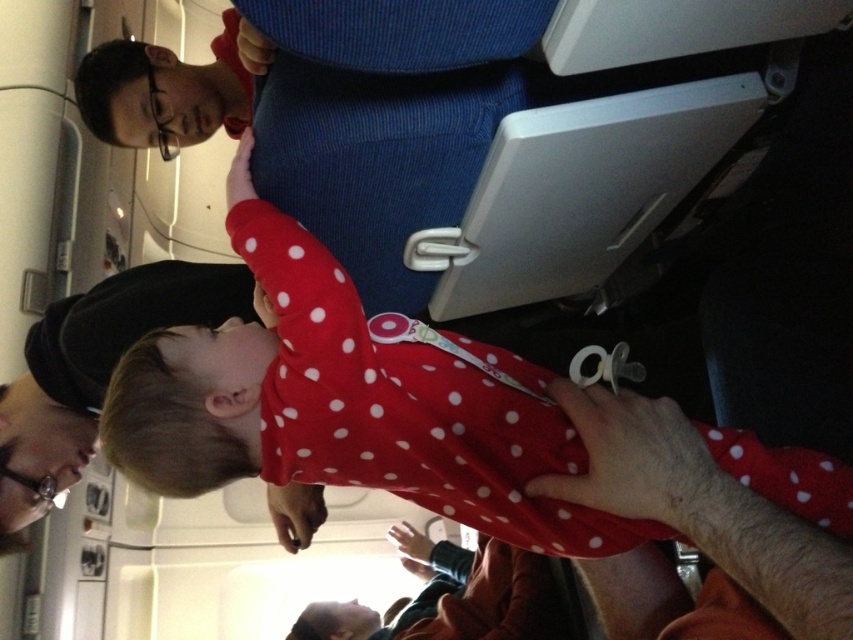
Between point (491, 515) and point (175, 77), which one is positioned in front?

Point (491, 515) is in front.

Can you confirm if red polka dot onesie at center is positioned below matte blue uniform at upper center?

Yes, red polka dot onesie at center is below matte blue uniform at upper center.

What do you see at coordinates (347, 403) in the screenshot? Image resolution: width=853 pixels, height=640 pixels. I see `red polka dot onesie at center` at bounding box center [347, 403].

Locate an element on the screen. red polka dot onesie at center is located at coordinates (347, 403).